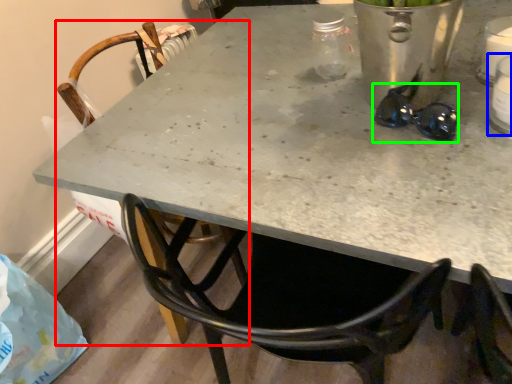
Question: Which is nearer to the chair (highlighted by a red box)? appliance (highlighted by a blue box) or glasses (highlighted by a green box).

Choices:
 (A) appliance
 (B) glasses

Answer: (B)